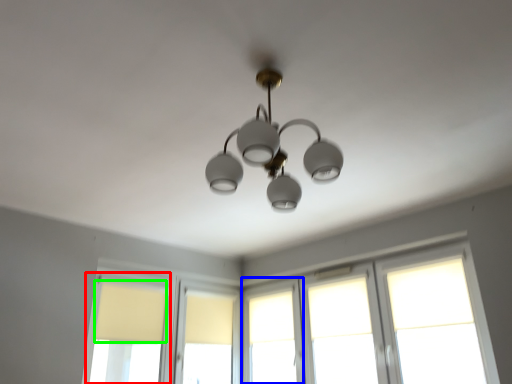
Question: Estimate the real-world distances between objects in this image. Which object is closer to window (highlighted by a red box), window (highlighted by a blue box) or curtain (highlighted by a green box)?

Choices:
 (A) window
 (B) curtain

Answer: (B)